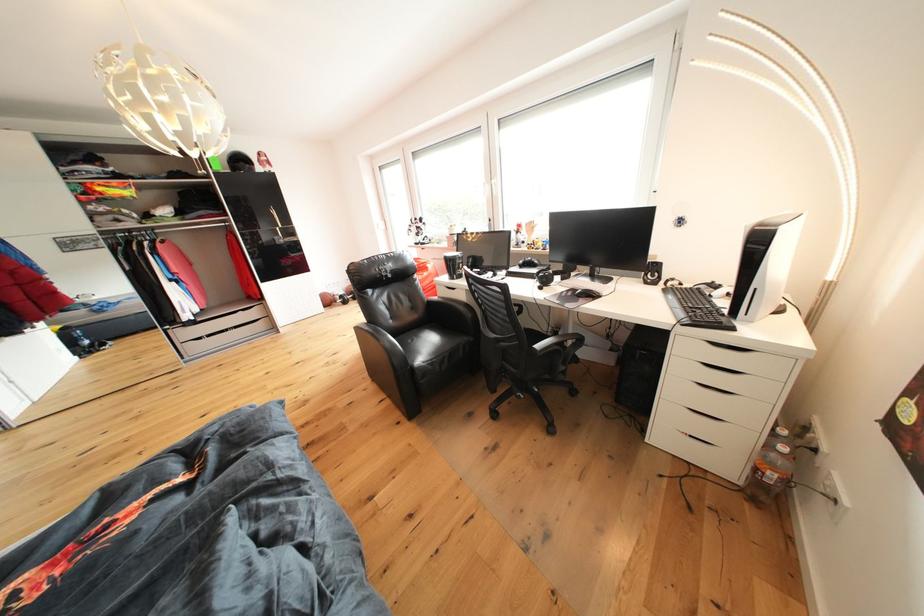
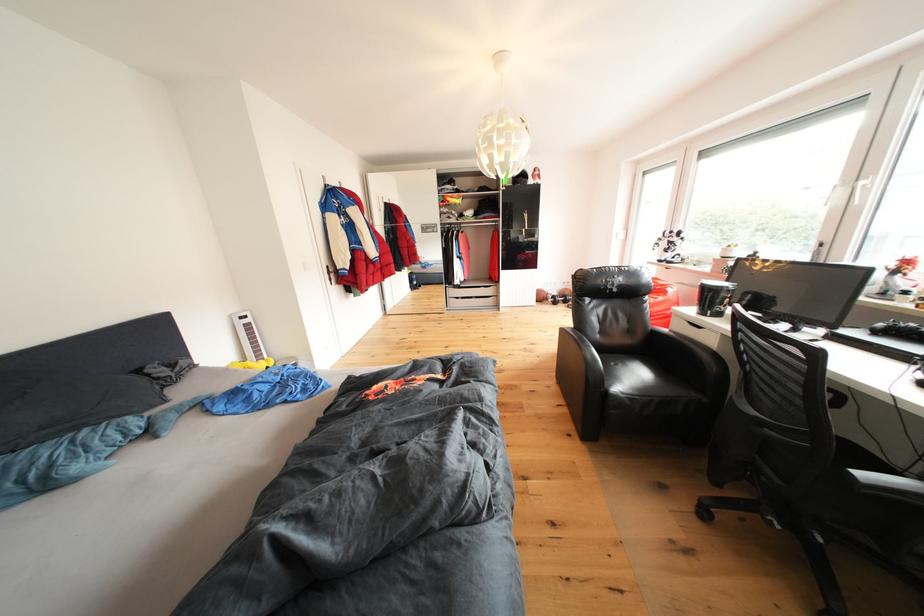
In the second image, find the point that corresponds to point 195,338 in the first image.

(463, 297)